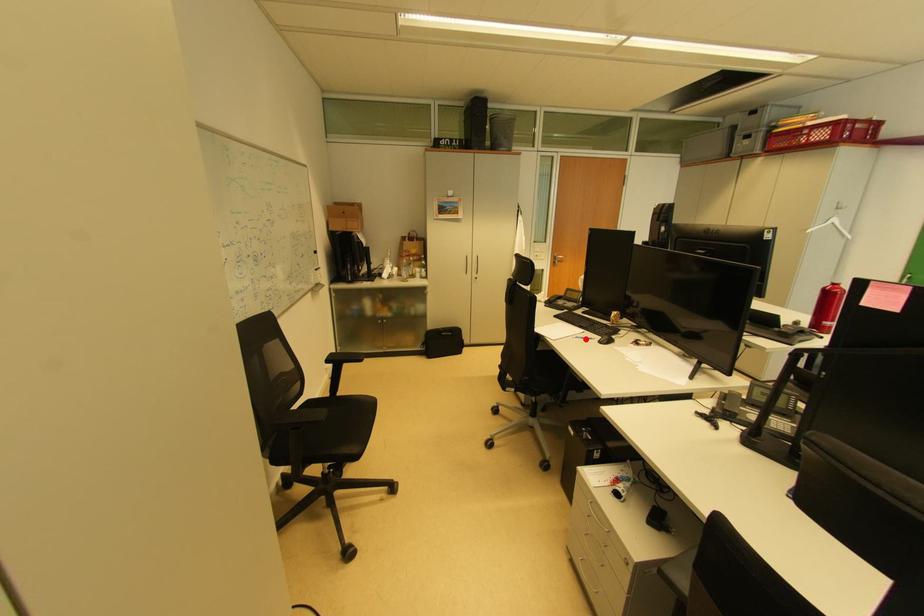
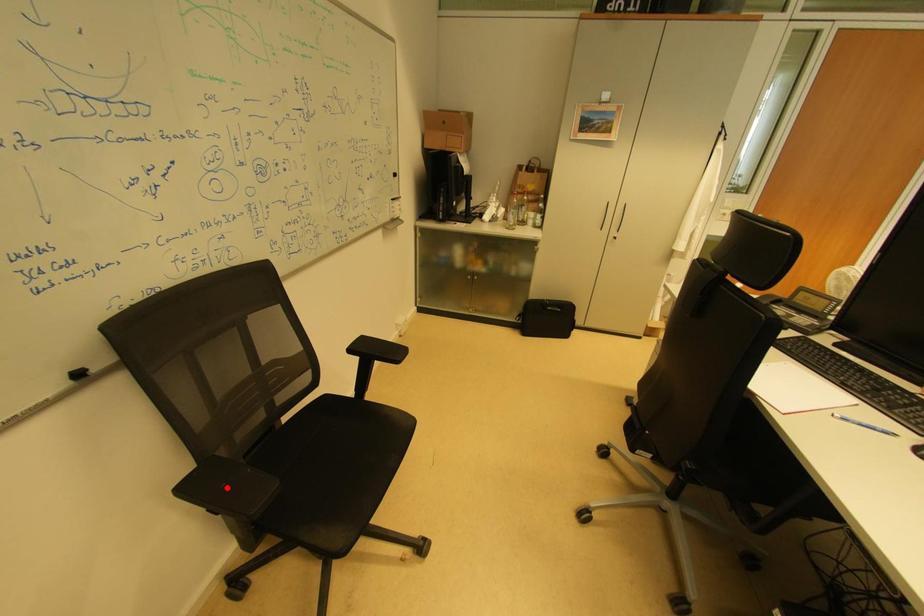
I am providing you with two images of the same scene from different viewpoints. A red point is marked on the first image and another point is marked on the second image. Is the red point in image1 aligned with the point shown in image2?

No